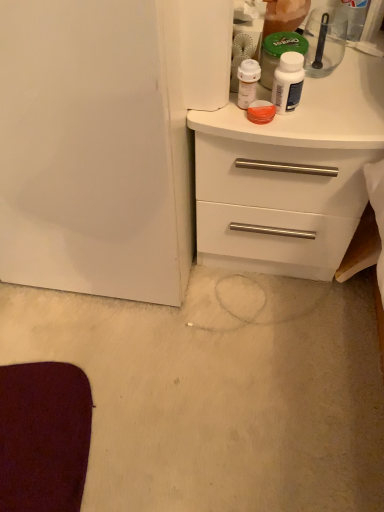
Where is `transparent plastic spoon at upper right`? The image size is (384, 512). transparent plastic spoon at upper right is located at coordinates (325, 41).

What are the coordinates of `white matte chest of drawers at upper right` in the screenshot? It's located at (289, 174).

Considering the sizes of transparent plastic spoon at upper right and white glossy bottle at upper right in the image, is transparent plastic spoon at upper right wider or thinner than white glossy bottle at upper right?

transparent plastic spoon at upper right is wider than white glossy bottle at upper right.

From the image's perspective, is transparent plastic spoon at upper right located above or below white glossy bottle at upper right?

transparent plastic spoon at upper right is situated higher than white glossy bottle at upper right in the image.

From the picture: Is transparent plastic spoon at upper right positioned in front of white glossy bottle at upper right?

No, transparent plastic spoon at upper right is further to the viewer.

Considering the points (313, 51) and (287, 92), which point is behind, point (313, 51) or point (287, 92)?

Positioned behind is point (313, 51).

Considering the sizes of objects transparent plastic spoon at upper right and white matte chest of drawers at upper right in the image provided, who is taller, transparent plastic spoon at upper right or white matte chest of drawers at upper right?

Standing taller between the two is white matte chest of drawers at upper right.

Considering the points (318, 39) and (297, 170), which point is in front, point (318, 39) or point (297, 170)?

The point (297, 170) is closer to the camera.

How distant is transparent plastic spoon at upper right from white matte chest of drawers at upper right?

The distance of transparent plastic spoon at upper right from white matte chest of drawers at upper right is 8.75 inches.

Is transparent plastic spoon at upper right thinner than white matte chest of drawers at upper right?

Indeed, transparent plastic spoon at upper right has a lesser width compared to white matte chest of drawers at upper right.

Is white glossy bottle at upper right touching transparent plastic spoon at upper right?

No, white glossy bottle at upper right is not in contact with transparent plastic spoon at upper right.

Considering the positions of point (292, 89) and point (325, 28), is point (292, 89) closer or farther from the camera than point (325, 28)?

Point (292, 89) is positioned closer to the camera compared to point (325, 28).

From a real-world perspective, who is located lower, white glossy bottle at upper right or transparent plastic spoon at upper right?

From a 3D spatial view, white glossy bottle at upper right is below.

Is white glossy bottle at upper right positioned beyond the bounds of white matte chest of drawers at upper right?

Yes, white glossy bottle at upper right is located beyond the bounds of white matte chest of drawers at upper right.

From the image's perspective, which one is positioned lower, white glossy bottle at upper right or white matte chest of drawers at upper right?

From the image's view, white matte chest of drawers at upper right is below.

Is white glossy bottle at upper right next to white matte chest of drawers at upper right and touching it?

No, white glossy bottle at upper right is not with white matte chest of drawers at upper right.

Between white glossy bottle at upper right and white matte chest of drawers at upper right, which one has larger size?

With larger size is white matte chest of drawers at upper right.

Would you say white matte chest of drawers at upper right is inside or outside transparent plastic spoon at upper right?

white matte chest of drawers at upper right is spatially situated outside transparent plastic spoon at upper right.

Is white matte chest of drawers at upper right in front of or behind transparent plastic spoon at upper right in the image?

white matte chest of drawers at upper right is in front of transparent plastic spoon at upper right.

Is white matte chest of drawers at upper right far from transparent plastic spoon at upper right?

white matte chest of drawers at upper right is actually quite close to transparent plastic spoon at upper right.

Considering the sizes of white matte chest of drawers at upper right and transparent plastic spoon at upper right in the image, is white matte chest of drawers at upper right bigger or smaller than transparent plastic spoon at upper right?

Clearly, white matte chest of drawers at upper right is larger in size than transparent plastic spoon at upper right.

Is the surface of white matte chest of drawers at upper right in direct contact with white glossy bottle at upper right?

No.

Is white matte chest of drawers at upper right oriented away from white glossy bottle at upper right?

white matte chest of drawers at upper right does not have its back to white glossy bottle at upper right.

Considering the relative sizes of white matte chest of drawers at upper right and white glossy bottle at upper right in the image provided, is white matte chest of drawers at upper right shorter than white glossy bottle at upper right?

No.

Find the location of `bottle below the transparent plastic spoon at upper right (from the image's perspective)`. bottle below the transparent plastic spoon at upper right (from the image's perspective) is located at coordinates (288, 82).

Image resolution: width=384 pixels, height=512 pixels. What are the coordinates of `chest of drawers to the left of transparent plastic spoon at upper right` in the screenshot? It's located at (289, 174).

When comparing their distances from white matte chest of drawers at upper right, does transparent plastic spoon at upper right or white glossy bottle at upper right seem further?

transparent plastic spoon at upper right is positioned further to the anchor white matte chest of drawers at upper right.

Which object lies further to the anchor point transparent plastic spoon at upper right, white glossy bottle at upper right or white matte chest of drawers at upper right?

white matte chest of drawers at upper right is positioned further to the anchor transparent plastic spoon at upper right.

From the image, which object appears to be farther from transparent plastic spoon at upper right, white matte chest of drawers at upper right or white glossy bottle at upper right?

The object further to transparent plastic spoon at upper right is white matte chest of drawers at upper right.

Considering their positions, is white glossy bottle at upper right positioned further to white matte chest of drawers at upper right than transparent plastic spoon at upper right?

transparent plastic spoon at upper right is positioned further to the anchor white matte chest of drawers at upper right.

Considering their positions, is white matte chest of drawers at upper right positioned closer to white glossy bottle at upper right than transparent plastic spoon at upper right?

white matte chest of drawers at upper right is closer to white glossy bottle at upper right.

Estimate the real-world distances between objects in this image. Which object is closer to white glossy bottle at upper right, transparent plastic spoon at upper right or white matte chest of drawers at upper right?

white matte chest of drawers at upper right is closer to white glossy bottle at upper right.

This screenshot has height=512, width=384. I want to click on bottle that lies between transparent plastic spoon at upper right and white matte chest of drawers at upper right from top to bottom, so click(288, 82).